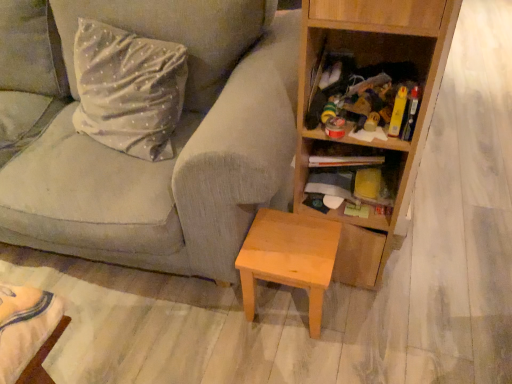
Where is `wooden shelf at center right`? wooden shelf at center right is located at coordinates (350, 162).

Find the location of `wooden bookcase at right`. wooden bookcase at right is located at coordinates (377, 141).

What is the approximate height of textured gray fabric couch at center?

It is 36.66 inches.

The height and width of the screenshot is (384, 512). Describe the element at coordinates (289, 258) in the screenshot. I see `light brown wood stool at lower center` at that location.

Where is `wooden shelf at center right`? The width and height of the screenshot is (512, 384). wooden shelf at center right is located at coordinates (x=350, y=162).

From the image's perspective, which is above, wooden shelf at center right or light brown wood stool at lower center?

wooden shelf at center right.

From a real-world perspective, who is located lower, wooden shelf at center right or light brown wood stool at lower center?

light brown wood stool at lower center, from a real-world perspective.

Can you confirm if wooden shelf at center right is thinner than light brown wood stool at lower center?

Yes, wooden shelf at center right is thinner than light brown wood stool at lower center.

How many degrees apart are the facing directions of wooden shelf at center right and light brown wood stool at lower center?

They differ by 8.79 degrees in their facing directions.

Are textured gray fabric couch at center and wooden shelf at center right located far from each other?

No, textured gray fabric couch at center is not far from wooden shelf at center right.

Is wooden shelf at center right surrounded by textured gray fabric couch at center?

Definitely not — wooden shelf at center right is not inside textured gray fabric couch at center.

Could you tell me if textured gray fabric couch at center is turned towards wooden shelf at center right?

No, textured gray fabric couch at center is not aimed at wooden shelf at center right.

From the image's perspective, would you say textured gray fabric couch at center is shown under wooden shelf at center right?

No, from the image's perspective, textured gray fabric couch at center is not beneath wooden shelf at center right.

Can you confirm if textured gray fabric couch at center is smaller than light brown wood stool at lower center?

No.

Which is nearer, (10, 226) or (284, 224)?

Point (10, 226) is farther from the camera than point (284, 224).

Is textured gray fabric couch at center at the right side of light brown wood stool at lower center?

In fact, textured gray fabric couch at center is to the left of light brown wood stool at lower center.

Does textured gray fabric couch at center contain light brown wood stool at lower center?

Indeed, light brown wood stool at lower center is located within textured gray fabric couch at center.

Looking at this image, is wooden bookcase at right to the right of textured gray fabric couch at center from the viewer's perspective?

Correct, you'll find wooden bookcase at right to the right of textured gray fabric couch at center.

How many degrees apart are the facing directions of wooden bookcase at right and textured gray fabric couch at center?

3 degrees.

Can you confirm if wooden bookcase at right is bigger than textured gray fabric couch at center?

Incorrect, wooden bookcase at right is not larger than textured gray fabric couch at center.

Is light brown wood stool at lower center not near textured gray fabric couch at center?

No, light brown wood stool at lower center is not far from textured gray fabric couch at center.

From a real-world perspective, which object stands above the other?

From a 3D spatial view, textured gray fabric couch at center is above.

Can we say light brown wood stool at lower center lies outside textured gray fabric couch at center?

No.

How different are the orientations of wooden bookcase at right and light brown wood stool at lower center in degrees?

There is a 2.59e-05-degree angle between the facing directions of wooden bookcase at right and light brown wood stool at lower center.

Image resolution: width=512 pixels, height=384 pixels. In the image, there is a wooden bookcase at right. What are the coordinates of `table below it (from the image's perspective)` in the screenshot? It's located at (289, 258).

In the image, is wooden bookcase at right positioned in front of or behind light brown wood stool at lower center?

Clearly, wooden bookcase at right is in front of light brown wood stool at lower center.

Based on their sizes in the image, would you say wooden bookcase at right is bigger or smaller than light brown wood stool at lower center?

Considering their sizes, wooden bookcase at right takes up more space than light brown wood stool at lower center.

At what (x,y) coordinates should I click in order to perform the action: click on bookcase located above the light brown wood stool at lower center (from the image's perspective). Please return your answer as a coordinate pair (x, y). Looking at the image, I should click on (377, 141).

Can you confirm if light brown wood stool at lower center is smaller than wooden bookcase at right?

Yes, light brown wood stool at lower center is smaller than wooden bookcase at right.

Considering the positions of point (322, 260) and point (301, 137), is point (322, 260) closer or farther from the camera than point (301, 137)?

Point (322, 260) is farther from the camera than point (301, 137).

Which of these two, light brown wood stool at lower center or wooden bookcase at right, stands taller?

wooden bookcase at right.

Find the location of `table located underneath the wooden shelf at center right (from a real-world perspective)`. table located underneath the wooden shelf at center right (from a real-world perspective) is located at coordinates (289, 258).

Identify the location of studio couch above the wooden shelf at center right (from the image's perspective). (173, 147).

From the image, which object appears to be nearer to light brown wood stool at lower center, textured gray fabric couch at center or wooden bookcase at right?

Among the two, wooden bookcase at right is located nearer to light brown wood stool at lower center.

Based on their spatial positions, is wooden shelf at center right or textured gray fabric couch at center further from light brown wood stool at lower center?

Among the two, textured gray fabric couch at center is located further to light brown wood stool at lower center.

Which object lies further to the anchor point wooden shelf at center right, wooden bookcase at right or textured gray fabric couch at center?

textured gray fabric couch at center lies further to wooden shelf at center right than the other object.

Looking at this image, looking at the image, which one is located further to light brown wood stool at lower center, textured gray fabric couch at center or wooden shelf at center right?

textured gray fabric couch at center.

Considering their positions, is light brown wood stool at lower center positioned further to wooden bookcase at right than wooden shelf at center right?

light brown wood stool at lower center is positioned further to the anchor wooden bookcase at right.

Based on their spatial positions, is light brown wood stool at lower center or textured gray fabric couch at center closer to wooden shelf at center right?

Based on the image, light brown wood stool at lower center appears to be nearer to wooden shelf at center right.

Estimate the real-world distances between objects in this image. Which object is closer to wooden bookcase at right, textured gray fabric couch at center or light brown wood stool at lower center?

The object closer to wooden bookcase at right is light brown wood stool at lower center.

When comparing their distances from wooden bookcase at right, does wooden shelf at center right or textured gray fabric couch at center seem closer?

wooden shelf at center right lies closer to wooden bookcase at right than the other object.

The image size is (512, 384). Identify the location of shelf located between textured gray fabric couch at center and wooden bookcase at right in the left-right direction. (350, 162).

Locate an element on the screen. Image resolution: width=512 pixels, height=384 pixels. table between textured gray fabric couch at center and wooden bookcase at right is located at coordinates (289, 258).

I want to click on table between wooden bookcase at right and wooden shelf at center right from front to back, so click(x=289, y=258).

The width and height of the screenshot is (512, 384). What are the coordinates of `table between textured gray fabric couch at center and wooden shelf at center right in the horizontal direction` in the screenshot? It's located at (289, 258).